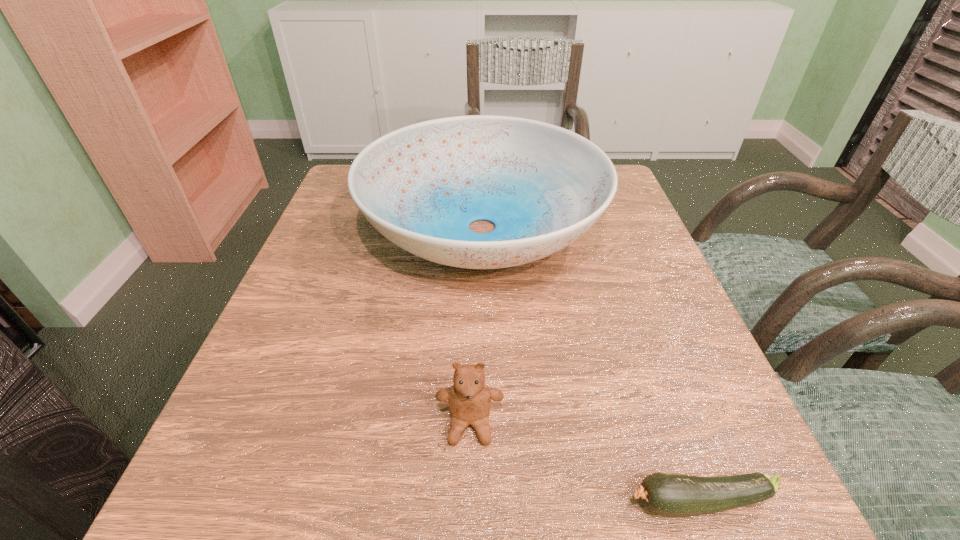
This screenshot has height=540, width=960. In order to click on free space located 0.400m at the blossom end of the nearest object in this screenshot , I will do `click(311, 502)`.

You are a GUI agent. You are given a task and a screenshot of the screen. Output one action in this format:
    pyautogui.click(x=<x>, y=<y>)
    Task: Click on the object that is at the far edge
    This screenshot has height=540, width=960.
    Given the screenshot: What is the action you would take?
    pyautogui.click(x=421, y=186)

At what (x,y) coordinates should I click in order to perform the action: click on object at the near edge. Please return your answer as a coordinate pair (x, y). Looking at the image, I should click on (673, 495).

Locate an element on the screen. This screenshot has height=540, width=960. object at the left edge is located at coordinates (421, 186).

Where is `dish present at the right edge`? dish present at the right edge is located at coordinates (421, 186).

Locate an element on the screen. zucchini present at the right edge is located at coordinates (673, 495).

I want to click on object located at the far left corner, so click(x=421, y=186).

Locate an element on the screen. The width and height of the screenshot is (960, 540). object that is at the far right corner is located at coordinates [421, 186].

Locate an element on the screen. The width and height of the screenshot is (960, 540). object located at the near right corner is located at coordinates (673, 495).

In the image, there is a desktop. Find the location of `vacant region at the near edge`. vacant region at the near edge is located at coordinates (616, 520).